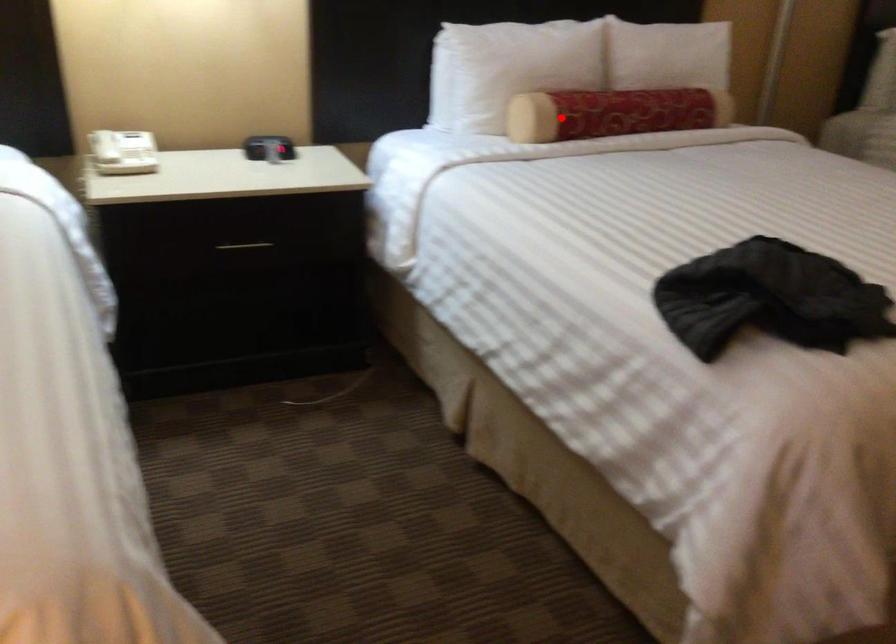
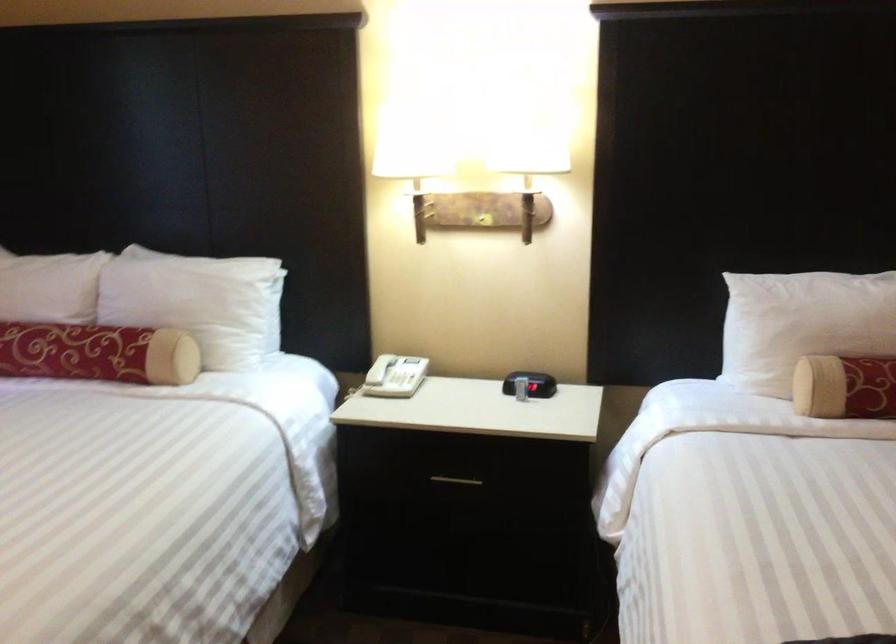
Find the pixel in the second image that matches the highlighted location in the first image.

(845, 386)